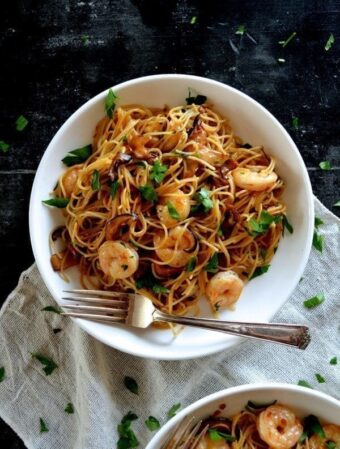
Find the location of a particular element. The width and height of the screenshot is (340, 449). table surface is located at coordinates (80, 59).